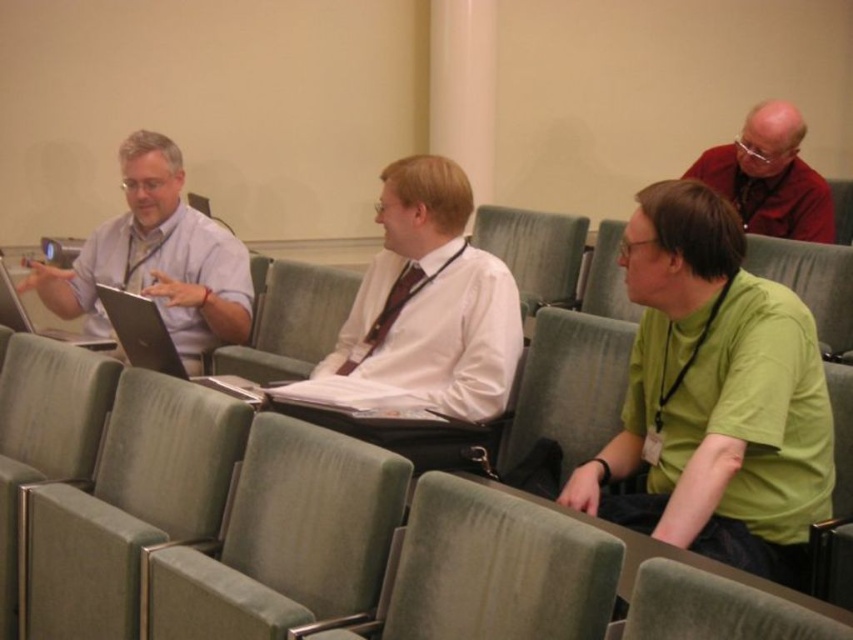
Question: Which object is positioned closest to the matte red shirt at upper right?

Choices:
 (A) green fabric chair at lower center
 (B) matte black laptop at center left
 (C) silver metallic laptop at left
 (D) white satin shirt at center

Answer: (D)

Question: Does green fabric chair at center have a smaller size compared to matte black laptop at center left?

Choices:
 (A) no
 (B) yes

Answer: (A)

Question: Considering the real-world distances, which object is farthest from the white satin shirt at center?

Choices:
 (A) silver metallic laptop at left
 (B) green fabric chair at lower center
 (C) matte red shirt at upper right
 (D) matte gray shirt at left

Answer: (C)

Question: Is velvet green chair at center below matte black laptop at center left?

Choices:
 (A) no
 (B) yes

Answer: (B)

Question: Where is green matte shirt at center located in relation to white satin shirt at center in the image?

Choices:
 (A) right
 (B) left

Answer: (A)

Question: Which point appears farthest from the camera in this image?

Choices:
 (A) (105, 312)
 (B) (816, 634)
 (C) (289, 452)

Answer: (A)